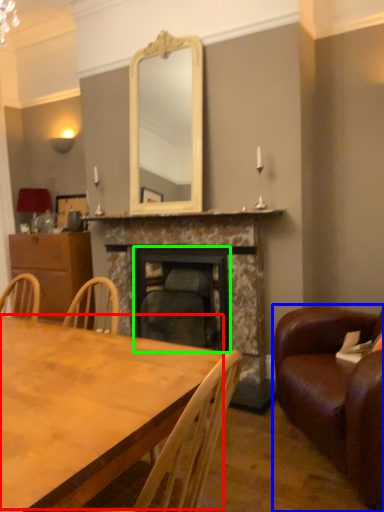
Question: Which object is positioned farthest from table top (highlighted by a red box)? Select from studio couch (highlighted by a blue box) and fireplace (highlighted by a green box).

Choices:
 (A) studio couch
 (B) fireplace

Answer: (B)